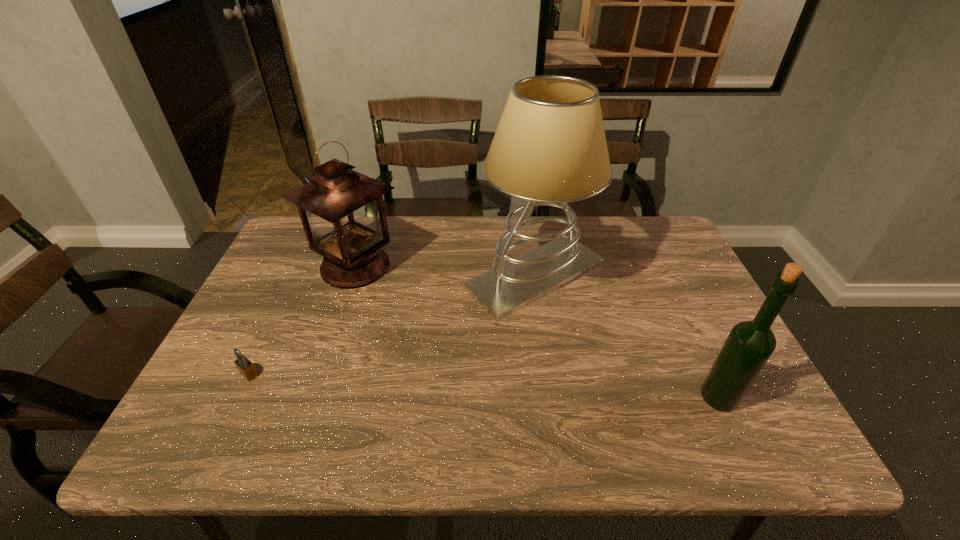
The width and height of the screenshot is (960, 540). I want to click on free space located on the front of the shortest object, so click(230, 413).

Where is `table lamp present at the far edge`? This screenshot has width=960, height=540. table lamp present at the far edge is located at coordinates (549, 148).

At what (x,y) coordinates should I click in order to perform the action: click on oil lamp located at the far edge. Please return your answer as a coordinate pair (x, y). This screenshot has height=540, width=960. Looking at the image, I should click on (342, 211).

Locate an element on the screen. oil lamp present at the left edge is located at coordinates (342, 211).

Locate an element on the screen. This screenshot has height=540, width=960. padlock that is positioned at the left edge is located at coordinates (246, 368).

Locate an element on the screen. The width and height of the screenshot is (960, 540). object that is at the right edge is located at coordinates (749, 345).

Where is `object located at the far left corner`? This screenshot has width=960, height=540. object located at the far left corner is located at coordinates (342, 211).

Where is `free region at the far edge of the desktop`? The image size is (960, 540). free region at the far edge of the desktop is located at coordinates (410, 227).

Locate an element on the screen. This screenshot has height=540, width=960. vacant region at the left edge is located at coordinates click(x=318, y=264).

In the image, there is a desktop. Identify the location of vacant space at the right edge. This screenshot has width=960, height=540. (672, 343).